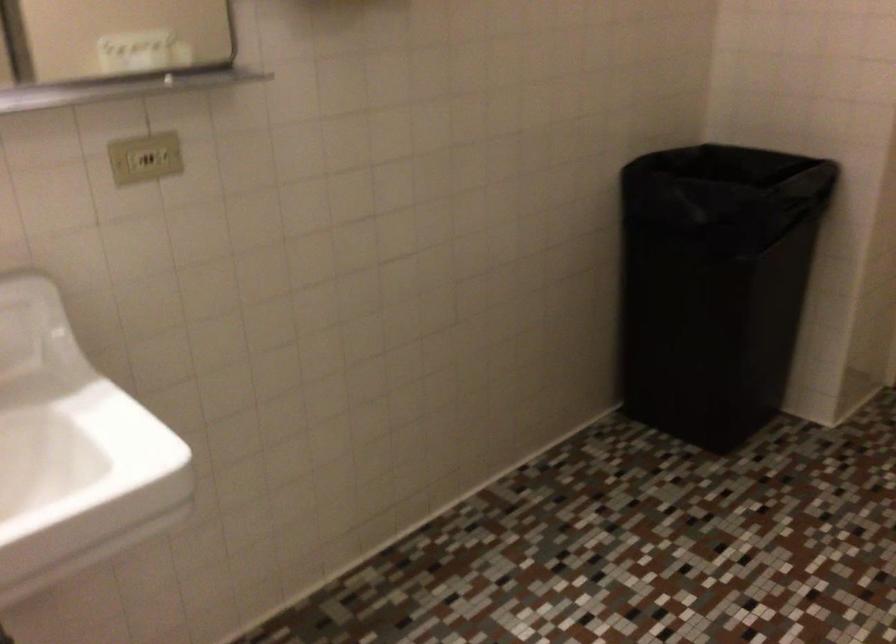
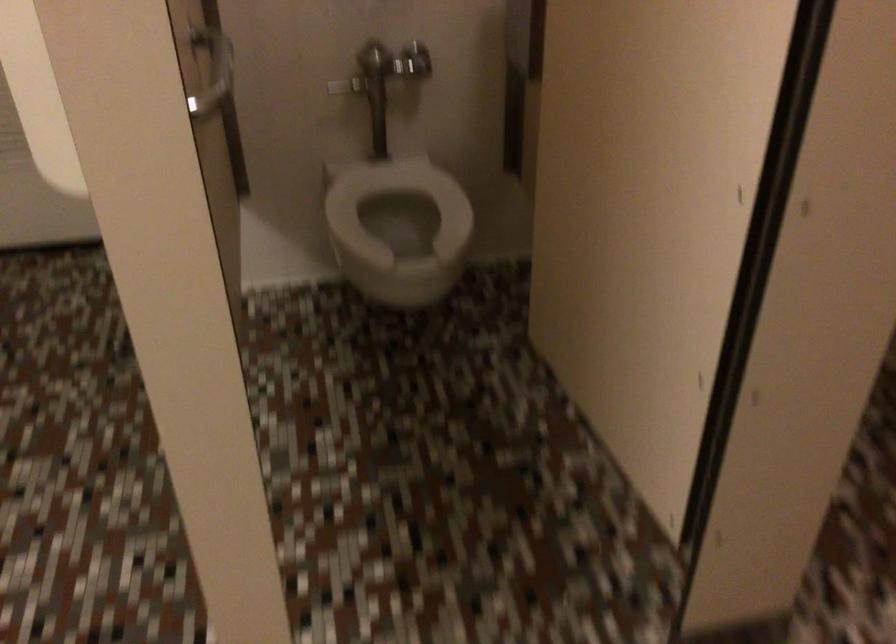
How did the camera likely rotate?

The camera's rotation is toward right-down.